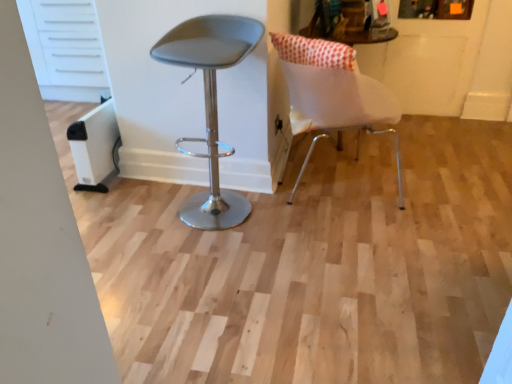
Where is `vacant space that is to the left of matte gray stool at center, the second chair from the right`? vacant space that is to the left of matte gray stool at center, the second chair from the right is located at coordinates (144, 216).